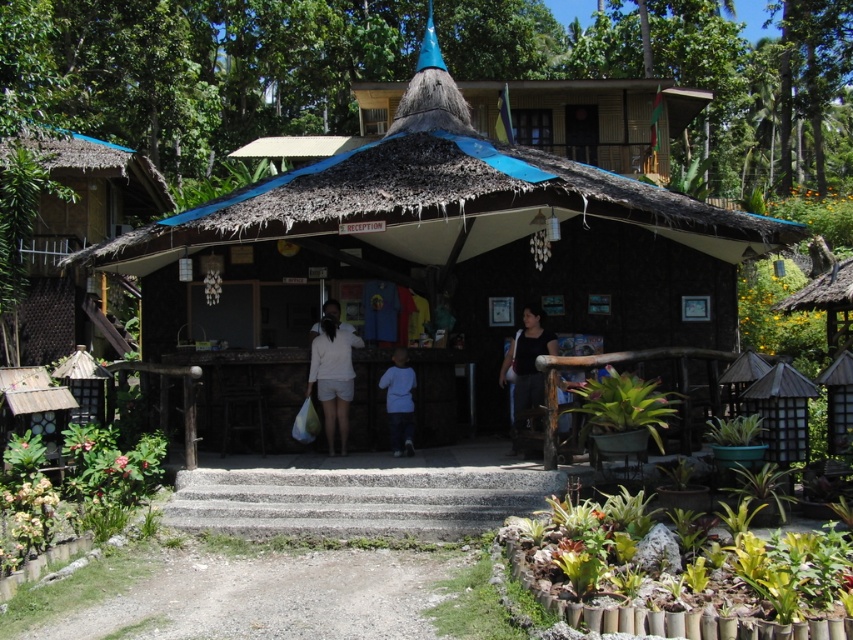
Question: Can you confirm if gray concrete stairs at center is positioned to the left of white matte shorts at center?

Choices:
 (A) no
 (B) yes

Answer: (A)

Question: Does brown thatch hut at center have a smaller size compared to white matte shorts at center?

Choices:
 (A) no
 (B) yes

Answer: (A)

Question: Which object is positioned closest to the white matte shorts at center?

Choices:
 (A) brown thatch hut at center
 (B) black fabric shirt at center
 (C) light blue fabric at center
 (D) gray concrete stairs at center

Answer: (C)

Question: Which point is closer to the camera?

Choices:
 (A) white matte shorts at center
 (B) black fabric shirt at center
 (C) gray concrete stairs at center

Answer: (C)

Question: Which object appears closest to the camera in this image?

Choices:
 (A) brown thatch hut at center
 (B) black fabric shirt at center
 (C) light blue fabric at center
 (D) gray concrete stairs at center

Answer: (D)

Question: Is white matte shorts at center bigger than light blue fabric at center?

Choices:
 (A) yes
 (B) no

Answer: (A)